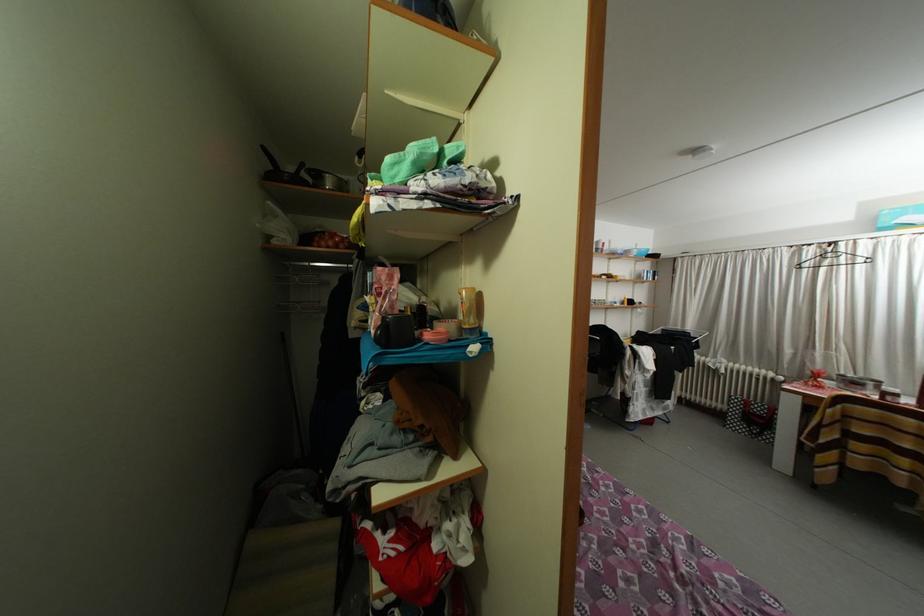
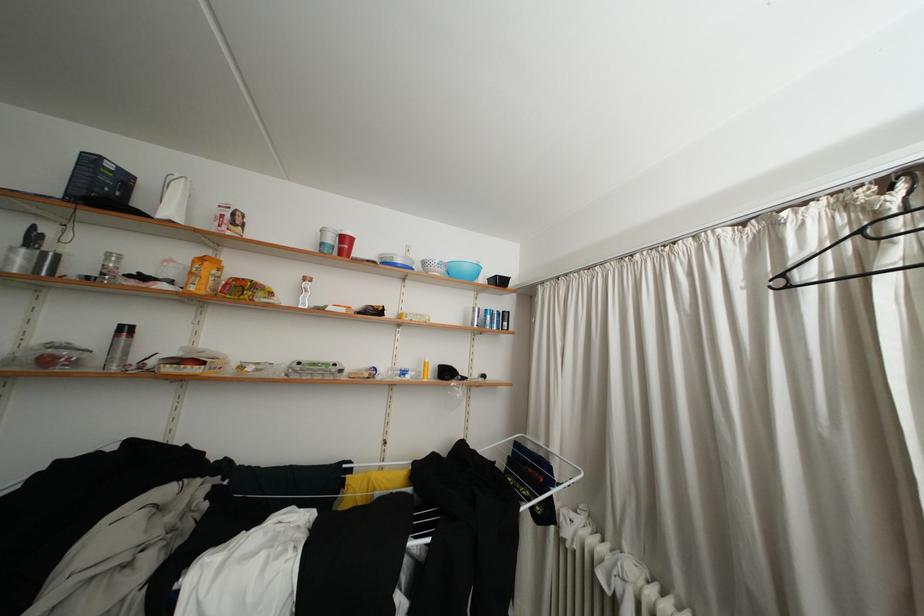
Which direction would the cameraman need to move to produce the second image?

The cameraman walked toward right, forward.